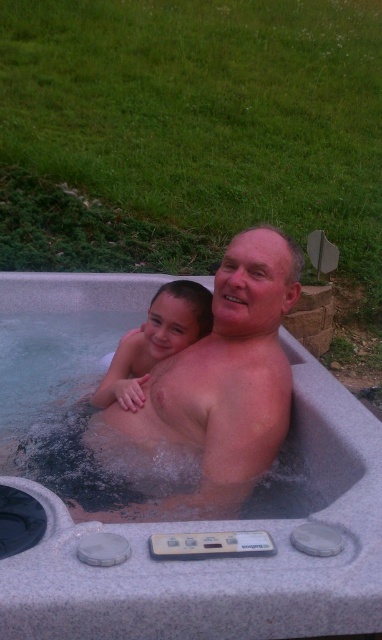
Question: Which object appears closest to the camera in this image?

Choices:
 (A) smooth skin man at center
 (B) gray plastic hot tub at center

Answer: (B)

Question: Is gray plastic hot tub at center further to the viewer compared to smooth skin man at center?

Choices:
 (A) yes
 (B) no

Answer: (B)

Question: Considering the real-world distances, which object is farthest from the smooth skin child at center?

Choices:
 (A) gray plastic hot tub at center
 (B) smooth skin man at center

Answer: (A)

Question: Estimate the real-world distances between objects in this image. Which object is closer to the smooth skin man at center?

Choices:
 (A) gray plastic hot tub at center
 (B) smooth skin child at center

Answer: (B)

Question: Is gray plastic hot tub at center bigger than smooth skin man at center?

Choices:
 (A) yes
 (B) no

Answer: (A)

Question: Is smooth skin man at center to the right of smooth skin child at center from the viewer's perspective?

Choices:
 (A) yes
 (B) no

Answer: (A)